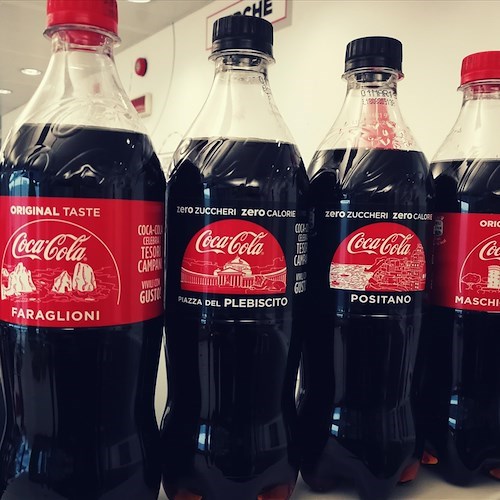
Image resolution: width=500 pixels, height=500 pixels. In order to click on bottle of soda in this screenshot , I will do `click(79, 96)`, `click(241, 101)`, `click(378, 127)`, `click(470, 120)`.